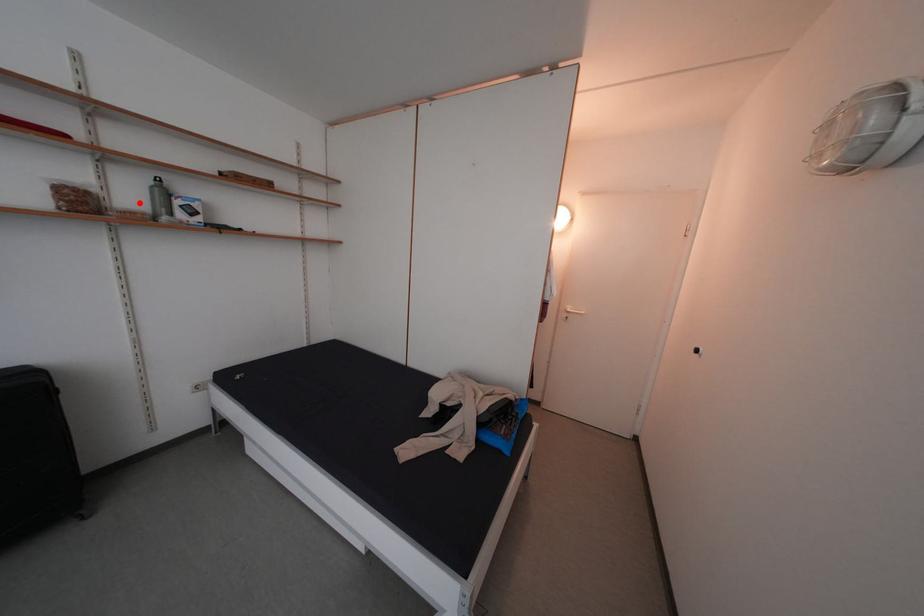
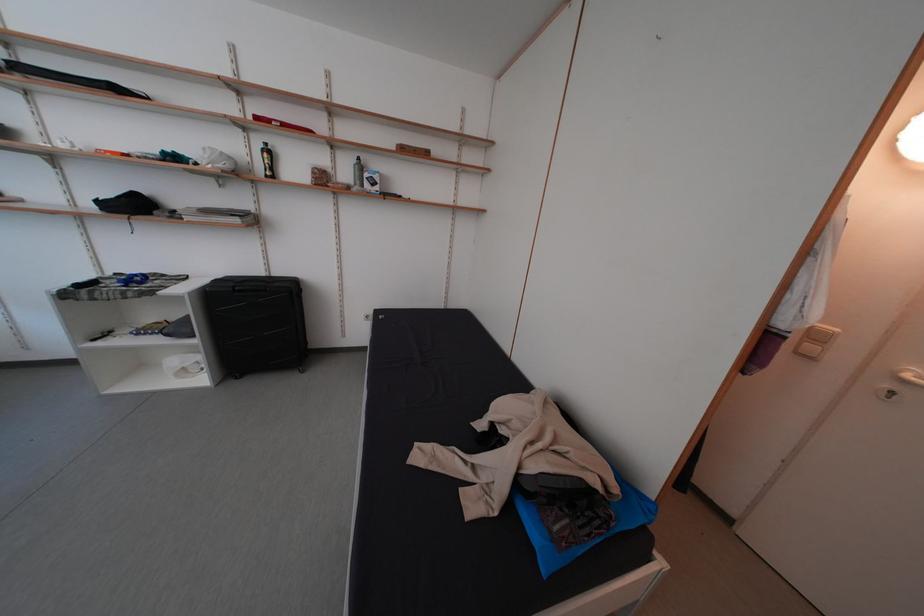
Question: I am providing you with two images of the same scene from different viewpoints. A red point is marked on the first image. Is the red point's position out of view in image 2?

Choices:
 (A) Yes
 (B) No

Answer: (B)